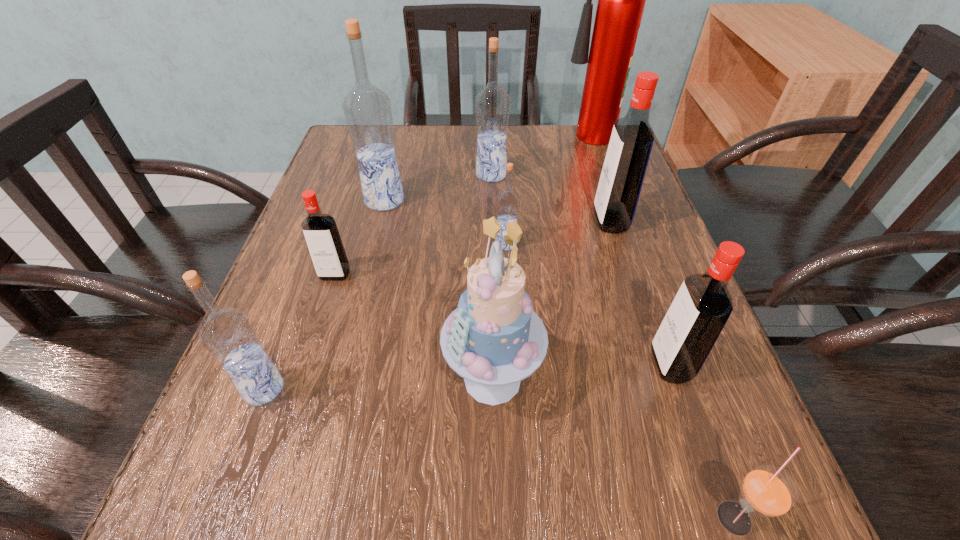
Image resolution: width=960 pixels, height=540 pixels. I want to click on the third biggest blue vodka, so click(227, 334).

Where is `the sixth farthest object`? Image resolution: width=960 pixels, height=540 pixels. the sixth farthest object is located at coordinates (320, 230).

This screenshot has width=960, height=540. What are the coordinates of `the leftmost red vodka` in the screenshot? It's located at (320, 230).

At what (x,y) coordinates should I click in order to perform the action: click on the smallest blue vodka. Please return your answer as a coordinate pair (x, y). The width and height of the screenshot is (960, 540). Looking at the image, I should click on (508, 201).

Identify the location of the third farthest blue vodka. This screenshot has width=960, height=540. (508, 201).

Where is `free space located at the nozzle of the tallest object`? free space located at the nozzle of the tallest object is located at coordinates (509, 143).

Find the location of a particular element. blank area located 0.140m at the nozzle of the tallest object is located at coordinates (509, 143).

Find the location of `vacant position located 0.340m at the nozzle of the tallest object`. vacant position located 0.340m at the nozzle of the tallest object is located at coordinates (432, 143).

I want to click on vacant space situated 0.090m on the right of the tallest vodka, so click(446, 200).

At what (x,y) coordinates should I click in order to perform the action: click on free space located 0.170m on the back of the ninth nearest object. Please return your answer as a coordinate pair (x, y). The height and width of the screenshot is (540, 960). Looking at the image, I should click on (490, 132).